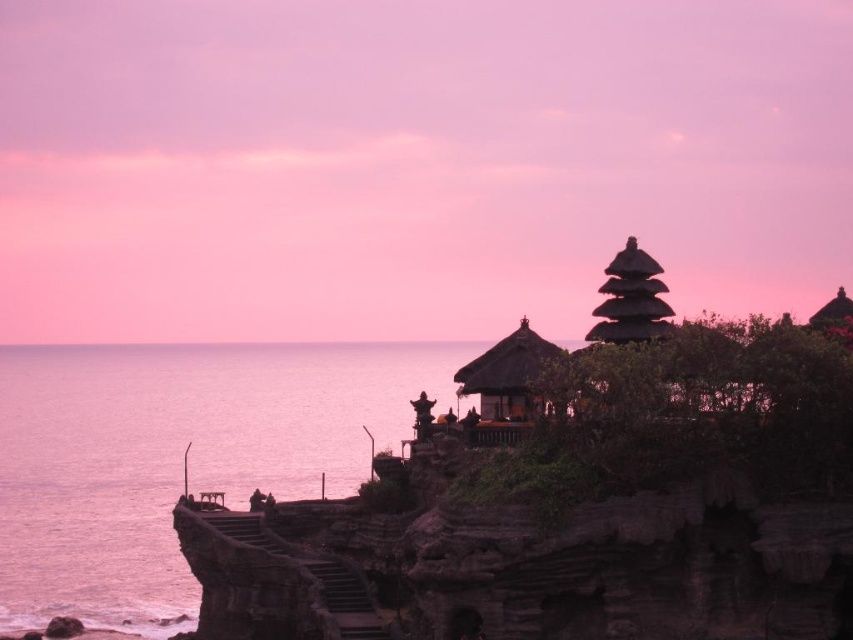
Question: Does wooden thatched roof gazebo at center have a larger size compared to matte brown pagoda at upper right?

Choices:
 (A) yes
 (B) no

Answer: (A)

Question: Which of the following is the farthest from the observer?

Choices:
 (A) matte brown pagoda at upper right
 (B) wooden thatched roof gazebo at center
 (C) transparent water at left

Answer: (A)

Question: Which point is farther to the camera?

Choices:
 (A) wooden thatched roof gazebo at center
 (B) matte brown pagoda at upper right

Answer: (B)

Question: Can you confirm if transparent water at left is positioned to the left of matte brown pagoda at upper right?

Choices:
 (A) no
 (B) yes

Answer: (B)

Question: Estimate the real-world distances between objects in this image. Which object is closer to the transparent water at left?

Choices:
 (A) wooden thatched roof gazebo at center
 (B) matte brown pagoda at upper right

Answer: (A)

Question: Can you confirm if transparent water at left is positioned below matte brown pagoda at upper right?

Choices:
 (A) no
 (B) yes

Answer: (B)